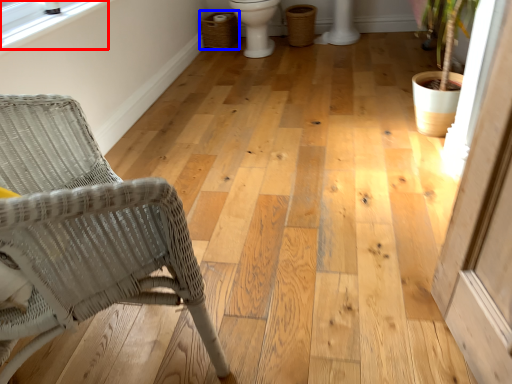
Question: Which object is further to the camera taking this photo, window screen (highlighted by a red box) or laundry basket (highlighted by a blue box)?

Choices:
 (A) window screen
 (B) laundry basket

Answer: (B)